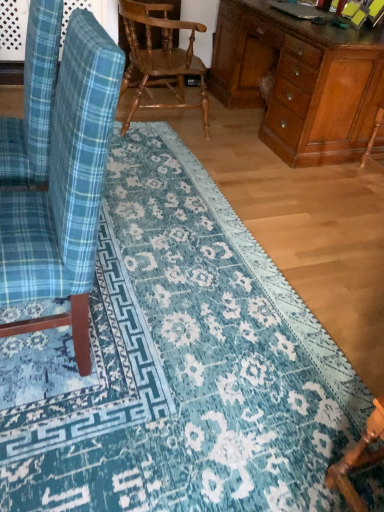
This screenshot has width=384, height=512. In order to click on wooden textured chair at center, which ranks as the 3th chair in front-to-back order in this screenshot , I will do `click(161, 58)`.

Image resolution: width=384 pixels, height=512 pixels. What do you see at coordinates (373, 136) in the screenshot?
I see `wooden armchair at right` at bounding box center [373, 136].

This screenshot has width=384, height=512. Find the location of `wooden armchair at right`. wooden armchair at right is located at coordinates (373, 136).

I want to click on wooden desk at right, so point(300,81).

The height and width of the screenshot is (512, 384). What do you see at coordinates (65, 191) in the screenshot? I see `blue plaid fabric chair at left, which is the first chair from front to back` at bounding box center [65, 191].

Identify the location of wooden chair at lower right, which is the 1th chair from bottom to top. The width and height of the screenshot is (384, 512). (358, 458).

Which point is more distant from viewer, (96, 227) or (164, 4)?

The point (164, 4) is farther from the camera.

Measure the distance from blue plaid fabric chair at left, the second chair in the top-to-bottom sequence, to wooden textured chair at center, positioned as the first chair in top-to-bottom order.

blue plaid fabric chair at left, the second chair in the top-to-bottom sequence, and wooden textured chair at center, positioned as the first chair in top-to-bottom order, are 1.80 meters apart.

In the scene shown: From the image's perspective, is blue plaid fabric chair at left, the 3th chair in the back-to-front sequence, located above or below wooden textured chair at center, arranged as the 3th chair when ordered from the bottom?

From the image's perspective, blue plaid fabric chair at left, the 3th chair in the back-to-front sequence, appears below wooden textured chair at center, arranged as the 3th chair when ordered from the bottom.

Who is shorter, blue plaid fabric chair at left, the second chair in the top-to-bottom sequence, or wooden textured chair at center, positioned as the first chair in top-to-bottom order?

With less height is wooden textured chair at center, positioned as the first chair in top-to-bottom order.

Is blue plaid fabric chair at left, the second chair in the top-to-bottom sequence, at the back of wooden textured chair at center, which ranks as the 3th chair in front-to-back order?

wooden textured chair at center, which ranks as the 3th chair in front-to-back order, does not have its back to blue plaid fabric chair at left, the second chair in the top-to-bottom sequence.

Considering the relative sizes of wooden textured chair at center, arranged as the 3th chair when ordered from the bottom, and blue plaid fabric chair at left, which is the 2th chair from bottom to top, in the image provided, is wooden textured chair at center, arranged as the 3th chair when ordered from the bottom, bigger than blue plaid fabric chair at left, which is the 2th chair from bottom to top,?

Yes, wooden textured chair at center, arranged as the 3th chair when ordered from the bottom, is bigger than blue plaid fabric chair at left, which is the 2th chair from bottom to top.

Is wooden textured chair at center, arranged as the 3th chair when ordered from the bottom, to the left of blue plaid fabric chair at left, the second chair in the top-to-bottom sequence, from the viewer's perspective?

In fact, wooden textured chair at center, arranged as the 3th chair when ordered from the bottom, is to the right of blue plaid fabric chair at left, the second chair in the top-to-bottom sequence.

From a real-world perspective, who is located higher, wooden textured chair at center, which ranks as the 3th chair in front-to-back order, or blue plaid fabric chair at left, which is the first chair from front to back?

From a 3D spatial view, blue plaid fabric chair at left, which is the first chair from front to back, is above.

How much distance is there between blue plaid fabric chair at left, which is the first chair from front to back, and wooden armchair at right?

blue plaid fabric chair at left, which is the first chair from front to back, is 7.83 feet from wooden armchair at right.

Would you say blue plaid fabric chair at left, which is the 2th chair from bottom to top, is inside or outside wooden armchair at right?

blue plaid fabric chair at left, which is the 2th chair from bottom to top, cannot be found inside wooden armchair at right.

Is blue plaid fabric chair at left, the 3th chair in the back-to-front sequence, at the right side of wooden armchair at right?

No, blue plaid fabric chair at left, the 3th chair in the back-to-front sequence, is not to the right of wooden armchair at right.

Would you consider blue plaid fabric chair at left, which is the first chair from front to back, to be distant from wooden desk at right?

blue plaid fabric chair at left, which is the first chair from front to back, is far away from wooden desk at right.

Which is in front, point (94, 78) or point (359, 44)?

The point (94, 78) is more forward.

Which of these two, blue plaid fabric chair at left, which is the first chair from front to back, or wooden desk at right, is wider?

wooden desk at right.

Is wooden desk at right at the back of blue plaid fabric chair at left, the 3th chair in the back-to-front sequence?

blue plaid fabric chair at left, the 3th chair in the back-to-front sequence, does not have its back to wooden desk at right.

The width and height of the screenshot is (384, 512). There is a wooden armchair at right. Identify the location of the 1st chair below it (from the image's perspective). (65, 191).

From a real-world perspective, is wooden armchair at right physically located above or below blue plaid fabric chair at left, the 3th chair in the back-to-front sequence?

wooden armchair at right is situated lower than blue plaid fabric chair at left, the 3th chair in the back-to-front sequence, in the real world.

Based on the photo, in the image, is wooden armchair at right on the left side or the right side of blue plaid fabric chair at left, the 3th chair in the back-to-front sequence?

In the image, wooden armchair at right appears on the right side of blue plaid fabric chair at left, the 3th chair in the back-to-front sequence.

Is wooden textured chair at center, positioned as the first chair in top-to-bottom order, inside the boundaries of wooden desk at right, or outside?

wooden textured chair at center, positioned as the first chair in top-to-bottom order, is spatially situated outside wooden desk at right.

Is wooden textured chair at center, positioned as the first chair in top-to-bottom order, at the left side of wooden desk at right?

Indeed, wooden textured chair at center, positioned as the first chair in top-to-bottom order, is positioned on the left side of wooden desk at right.

Could you tell me if wooden textured chair at center, positioned as the first chair in top-to-bottom order, is facing wooden desk at right?

Yes, wooden textured chair at center, positioned as the first chair in top-to-bottom order, is facing wooden desk at right.

In terms of height, does wooden desk at right look taller or shorter compared to wooden armchair at right?

Clearly, wooden desk at right is taller compared to wooden armchair at right.

Can you confirm if wooden desk at right is thinner than wooden armchair at right?

Incorrect, the width of wooden desk at right is not less than that of wooden armchair at right.

How different are the orientations of wooden desk at right and wooden armchair at right in degrees?

There is a 0.0104-degree angle between the facing directions of wooden desk at right and wooden armchair at right.

Looking at this image, does wooden desk at right lie behind wooden armchair at right?

No, it is in front of wooden armchair at right.

Where is `chair to the left of wooden textured chair at center, arranged as the 3th chair when ordered from the bottom`? chair to the left of wooden textured chair at center, arranged as the 3th chair when ordered from the bottom is located at coordinates (65, 191).

There is a blue plaid fabric chair at left, the second chair in the top-to-bottom sequence. In order to click on the 1st chair below it (from a real-world perspective) in this screenshot , I will do `click(161, 58)`.

From the image, which object appears to be farther from wooden textured chair at center, which appears as the 1th chair when viewed from the back, wooden desk at right or blue plaid fabric chair at left, the 3th chair in the back-to-front sequence?

blue plaid fabric chair at left, the 3th chair in the back-to-front sequence, is further to wooden textured chair at center, which appears as the 1th chair when viewed from the back.

Looking at the image, which one is located closer to wooden chair at lower right, which is the 2th chair in back-to-front order, blue plaid fabric chair at left, which is the 2th chair from bottom to top, or wooden desk at right?

blue plaid fabric chair at left, which is the 2th chair from bottom to top, is positioned closer to the anchor wooden chair at lower right, which is the 2th chair in back-to-front order.

From the image, which object appears to be nearer to wooden textured chair at center, which ranks as the 3th chair in front-to-back order, wooden chair at lower right, placed as the 2th chair when sorted from front to back, or wooden armchair at right?

Based on the image, wooden armchair at right appears to be nearer to wooden textured chair at center, which ranks as the 3th chair in front-to-back order.

In the scene shown: Estimate the real-world distances between objects in this image. Which object is further from wooden desk at right, wooden textured chair at center, which ranks as the 3th chair in front-to-back order, or wooden chair at lower right, the third chair in the top-to-bottom sequence?

wooden chair at lower right, the third chair in the top-to-bottom sequence, is further to wooden desk at right.

Based on their spatial positions, is blue plaid fabric chair at left, which is the first chair from front to back, or wooden textured chair at center, arranged as the 3th chair when ordered from the bottom, closer to wooden desk at right?

Based on the image, wooden textured chair at center, arranged as the 3th chair when ordered from the bottom, appears to be nearer to wooden desk at right.

From the image, which object appears to be farther from wooden textured chair at center, positioned as the first chair in top-to-bottom order, blue plaid fabric chair at left, which is the first chair from front to back, or wooden chair at lower right, which is the 1th chair from bottom to top?

Among the two, wooden chair at lower right, which is the 1th chair from bottom to top, is located further to wooden textured chair at center, positioned as the first chair in top-to-bottom order.

Estimate the real-world distances between objects in this image. Which object is further from blue plaid fabric chair at left, the 3th chair in the back-to-front sequence, wooden chair at lower right, which is the 1th chair from bottom to top, or wooden armchair at right?

wooden armchair at right is positioned further to the anchor blue plaid fabric chair at left, the 3th chair in the back-to-front sequence.

Looking at the image, which one is located closer to blue plaid fabric chair at left, which is the 2th chair from bottom to top, wooden chair at lower right, which is the 2th chair in back-to-front order, or wooden desk at right?

wooden chair at lower right, which is the 2th chair in back-to-front order, is closer to blue plaid fabric chair at left, which is the 2th chair from bottom to top.

At what (x,y) coordinates should I click in order to perform the action: click on armchair between wooden textured chair at center, positioned as the first chair in top-to-bottom order, and wooden chair at lower right, which is the 1th chair from bottom to top, in the vertical direction. Please return your answer as a coordinate pair (x, y). Looking at the image, I should click on (373, 136).

Locate an element on the screen. desk between wooden textured chair at center, arranged as the 3th chair when ordered from the bottom, and wooden armchair at right is located at coordinates (300, 81).

You are a GUI agent. You are given a task and a screenshot of the screen. Output one action in this format:
    pyautogui.click(x=<x>, y=<y>)
    Task: Click on the armchair that lies between wooden desk at right and wooden chair at lower right, which is the 1th chair from bottom to top, from top to bottom
    The height and width of the screenshot is (512, 384).
    Given the screenshot: What is the action you would take?
    pyautogui.click(x=373, y=136)

Find the location of a particular element. desk located between blue plaid fabric chair at left, which is the 2th chair from bottom to top, and wooden armchair at right in the depth direction is located at coordinates (300, 81).